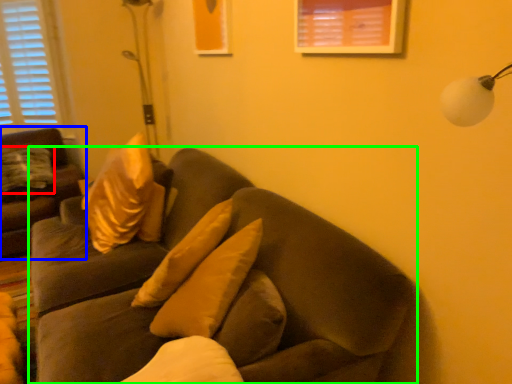
Question: Which object is positioned farthest from pillow (highlighted by a red box)? Select from studio couch (highlighted by a blue box) and studio couch (highlighted by a green box).

Choices:
 (A) studio couch
 (B) studio couch

Answer: (B)